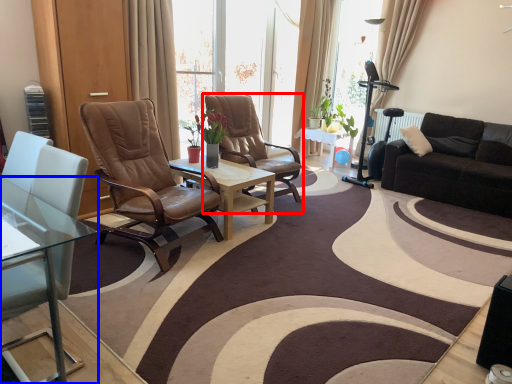
Question: Which of the following is the closest to the observer, chair (highlighted by a red box) or coffee table (highlighted by a blue box)?

Choices:
 (A) chair
 (B) coffee table

Answer: (B)